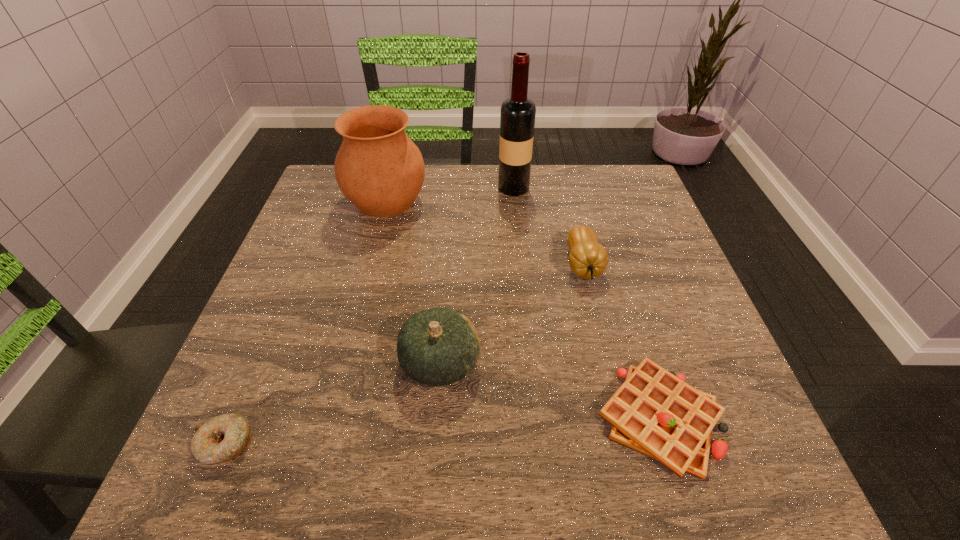
The image size is (960, 540). I want to click on pottery at the left edge, so click(x=379, y=169).

You are a GUI agent. You are given a task and a screenshot of the screen. Output one action in this format:
    pyautogui.click(x=<x>, y=<y>)
    Task: Click on the doughnut present at the left edge
    Image resolution: width=960 pixels, height=540 pixels.
    Given the screenshot: What is the action you would take?
    pyautogui.click(x=223, y=438)

Where is `object that is at the right edge`? The image size is (960, 540). object that is at the right edge is located at coordinates (654, 412).

I want to click on object at the far left corner, so click(379, 169).

What are the coordinates of `object positioned at the near left corner` in the screenshot? It's located at (223, 438).

The image size is (960, 540). In order to click on object that is positioned at the near right corner in this screenshot , I will do `click(654, 412)`.

This screenshot has width=960, height=540. In the image, there is a desktop. What are the coordinates of `blank space at the far edge` in the screenshot? It's located at (481, 181).

The image size is (960, 540). I want to click on free space at the near edge of the desktop, so click(480, 433).

Where is `vacant space at the left edge of the desktop`? The image size is (960, 540). vacant space at the left edge of the desktop is located at coordinates (263, 299).

Locate an element on the screen. Image resolution: width=960 pixels, height=540 pixels. vacant point at the right edge is located at coordinates (600, 239).